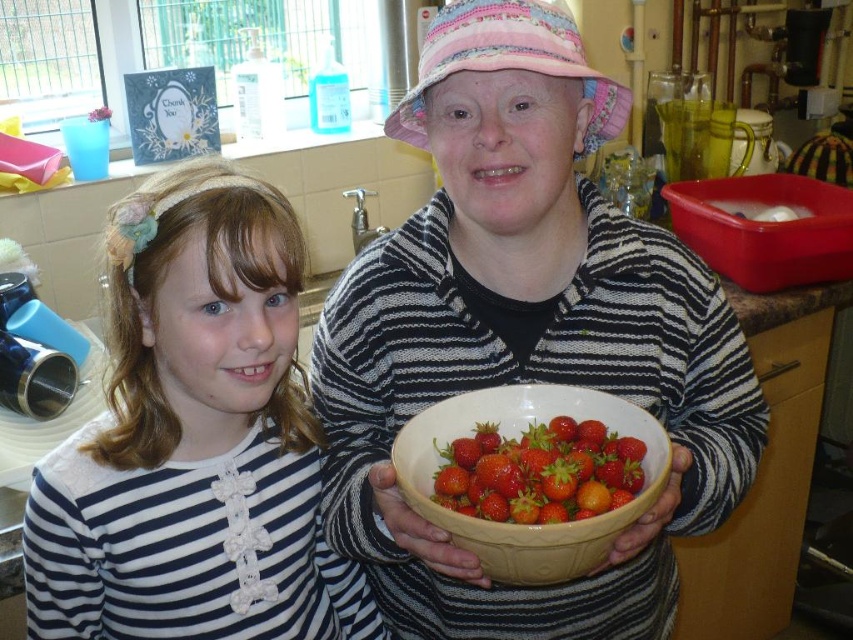
Question: Which of these objects is positioned closest to the white striped shirt at center?

Choices:
 (A) white ceramic bowl at center
 (B) glossy red strawberries at center

Answer: (A)

Question: Does matte ceramic bowl at center appear over white striped shirt at center?

Choices:
 (A) yes
 (B) no

Answer: (A)

Question: Does white striped shirt at center appear on the left side of glossy red strawberries at center?

Choices:
 (A) yes
 (B) no

Answer: (A)

Question: Which point appears closest to the camera in this image?

Choices:
 (A) (587, 145)
 (B) (276, 609)

Answer: (B)

Question: Which object is positioned closest to the glossy red strawberries at center?

Choices:
 (A) matte ceramic bowl at center
 (B) white ceramic bowl at center
 (C) white striped shirt at center

Answer: (B)

Question: Does matte ceramic bowl at center appear under white striped shirt at center?

Choices:
 (A) yes
 (B) no

Answer: (B)